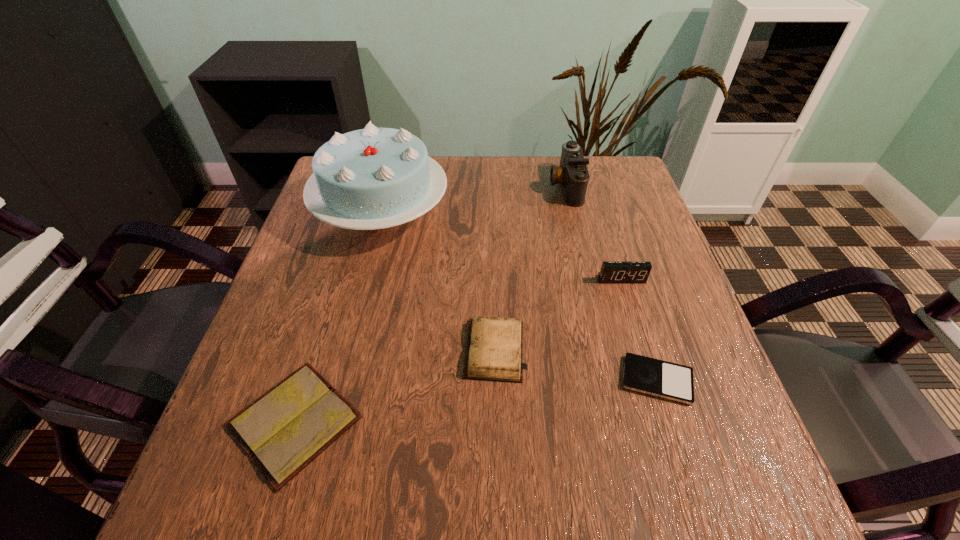
This screenshot has width=960, height=540. In order to click on birthday cake present at the left edge in this screenshot , I will do `click(373, 178)`.

Find the location of a particular element. Image resolution: width=960 pixels, height=540 pixels. diary that is at the left edge is located at coordinates (284, 430).

Find the location of a particular element. camera that is at the right edge is located at coordinates (572, 174).

The height and width of the screenshot is (540, 960). I want to click on alarm clock that is at the right edge, so click(611, 272).

Find the location of a particular element. iPod that is at the right edge is located at coordinates (655, 377).

Identify the location of object located in the far left corner section of the desktop. click(373, 178).

Locate an element on the screen. object that is at the near left corner is located at coordinates (284, 430).

Locate an element on the screen. The height and width of the screenshot is (540, 960). object at the far right corner is located at coordinates (572, 174).

Where is `vacant space at the far edge of the desktop`? The width and height of the screenshot is (960, 540). vacant space at the far edge of the desktop is located at coordinates (495, 203).

In order to click on vacant area at the left edge in this screenshot , I will do click(x=294, y=282).